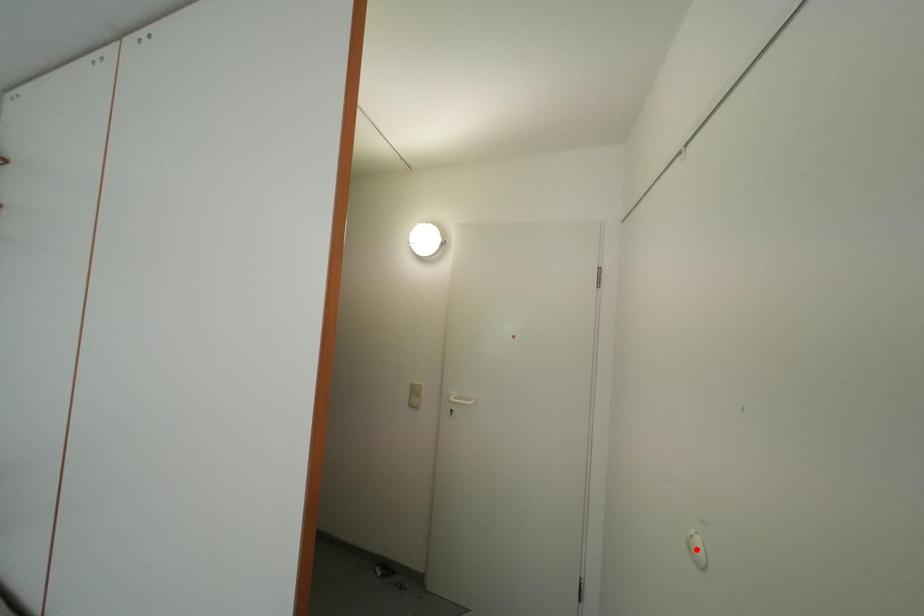
Question: In the image, two points are highlighted. Which point is nearer to the camera? Reply with the corresponding letter.

Choices:
 (A) blue point
 (B) red point

Answer: (A)